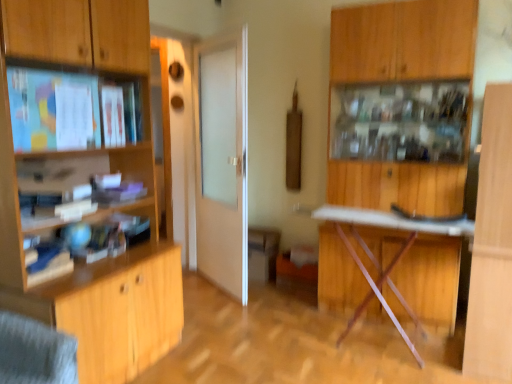
Question: From a real-world perspective, is wooden cabinet at left, which is the first cabinetry from left to right, on top of wooden cabinet at center, placed as the first cabinetry when sorted from back to front?

Choices:
 (A) no
 (B) yes

Answer: (B)

Question: Is wooden cabinet at left, which appears as the 2th cabinetry when viewed from the back, directly adjacent to wooden cabinet at center, which appears as the second cabinetry when viewed from the front?

Choices:
 (A) no
 (B) yes

Answer: (A)

Question: Is wooden cabinet at left, which is the first cabinetry from left to right, far from wooden cabinet at center, the first cabinetry when ordered from right to left?

Choices:
 (A) yes
 (B) no

Answer: (A)

Question: From a real-world perspective, is wooden cabinet at left, which is the first cabinetry from left to right, positioned under wooden cabinet at center, placed as the first cabinetry when sorted from back to front, based on gravity?

Choices:
 (A) yes
 (B) no

Answer: (B)

Question: Is wooden cabinet at center, acting as the second cabinetry starting from the left, inside wooden cabinet at left, which ranks as the 1th cabinetry in front-to-back order?

Choices:
 (A) no
 (B) yes

Answer: (A)

Question: From a real-world perspective, relative to metallic silver table at center, is matte wooden shelf at upper left vertically above or below?

Choices:
 (A) below
 (B) above

Answer: (B)

Question: From the image's perspective, is matte wooden shelf at upper left above or below metallic silver table at center?

Choices:
 (A) below
 (B) above

Answer: (B)

Question: Considering the positions of matte wooden shelf at upper left and metallic silver table at center in the image, is matte wooden shelf at upper left taller or shorter than metallic silver table at center?

Choices:
 (A) tall
 (B) short

Answer: (B)

Question: Is point (32, 142) closer or farther from the camera than point (407, 220)?

Choices:
 (A) farther
 (B) closer

Answer: (B)

Question: Considering the positions of wooden cabinet at left, which appears as the 2th cabinetry when viewed from the back, and wooden cabinet at center, acting as the second cabinetry starting from the left, in the image, is wooden cabinet at left, which appears as the 2th cabinetry when viewed from the back, taller or shorter than wooden cabinet at center, acting as the second cabinetry starting from the left,?

Choices:
 (A) short
 (B) tall

Answer: (B)

Question: From a real-world perspective, relative to wooden cabinet at center, placed as the first cabinetry when sorted from back to front, is wooden cabinet at left, which ranks as the 1th cabinetry in front-to-back order, vertically above or below?

Choices:
 (A) below
 (B) above

Answer: (B)

Question: Considering the positions of wooden cabinet at left, which appears as the 2th cabinetry when viewed from the back, and wooden cabinet at center, acting as the second cabinetry starting from the left, in the image, is wooden cabinet at left, which appears as the 2th cabinetry when viewed from the back, wider or thinner than wooden cabinet at center, acting as the second cabinetry starting from the left,?

Choices:
 (A) wide
 (B) thin

Answer: (A)

Question: From the image's perspective, is wooden cabinet at left, which is counted as the 2th cabinetry, starting from the right, positioned above or below wooden cabinet at center, which appears as the second cabinetry when viewed from the front?

Choices:
 (A) above
 (B) below

Answer: (A)

Question: From a real-world perspective, is wooden cabinet at center, acting as the second cabinetry starting from the left, physically located above or below wooden cabinet at left, which is the first cabinetry from left to right?

Choices:
 (A) below
 (B) above

Answer: (A)

Question: Is wooden cabinet at center, the first cabinetry when ordered from right to left, spatially inside wooden cabinet at left, which is the first cabinetry from left to right, or outside of it?

Choices:
 (A) inside
 (B) outside

Answer: (B)